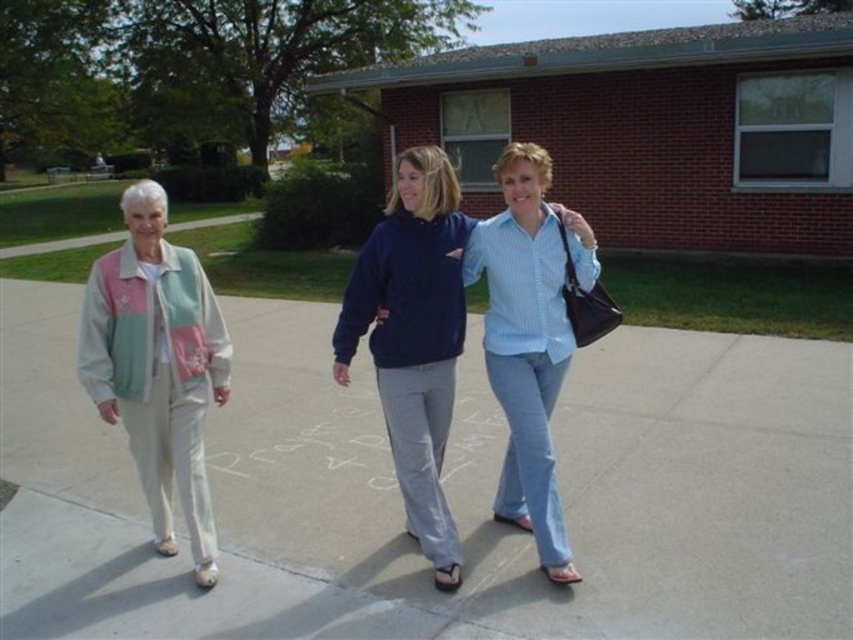
There are two people in the image. The first is wearing a blue cotton shirt at center and the second is wearing a dark blue hoodie on the left. How far apart are they?

The blue cotton shirt at center and the dark blue hoodie on the left are 3.11 meters apart.

You are standing at the point with coordinates point (598, 273) and want to walk to the point with coordinates point (494, 584). Which direction should you move relative to the building?

You should move forward towards the building because point (494, 584) is in front of point (598, 273) relative to the building.

You are a delivery robot with a 1.2 meter wide package. You need to deliver it along the light gray concrete sidewalk at center while avoiding the light blue denim jeans at center. Is the sidewalk wide enough for the package?

The light gray concrete sidewalk at center is narrower than the light blue denim jeans at center, so the 1.2 meter wide package may not fit on the sidewalk. Consider an alternative route or a smaller package.